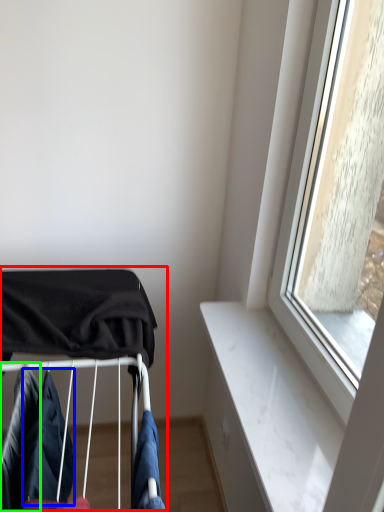
Question: Which object is positioned closest to baby carriage (highlighted by a red box)? Select from clothing (highlighted by a blue box) and clothing (highlighted by a green box).

Choices:
 (A) clothing
 (B) clothing

Answer: (A)